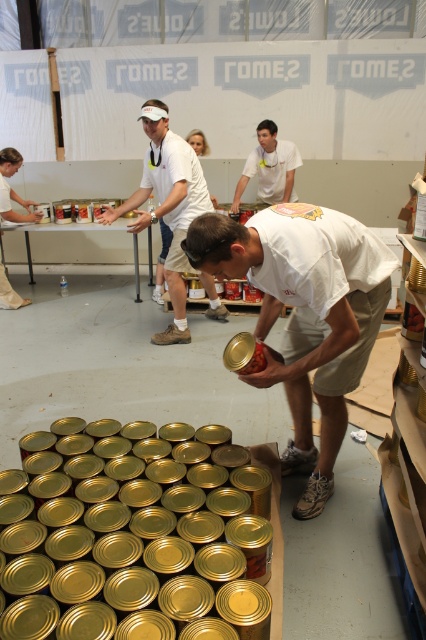
You are a volunteer at the food distribution event. You notice the matte white shirt at center and the shiny metallic can at center. Which object takes up more space in the image?

The matte white shirt at center is larger in size than the shiny metallic can at center, so it takes up more space in the image.